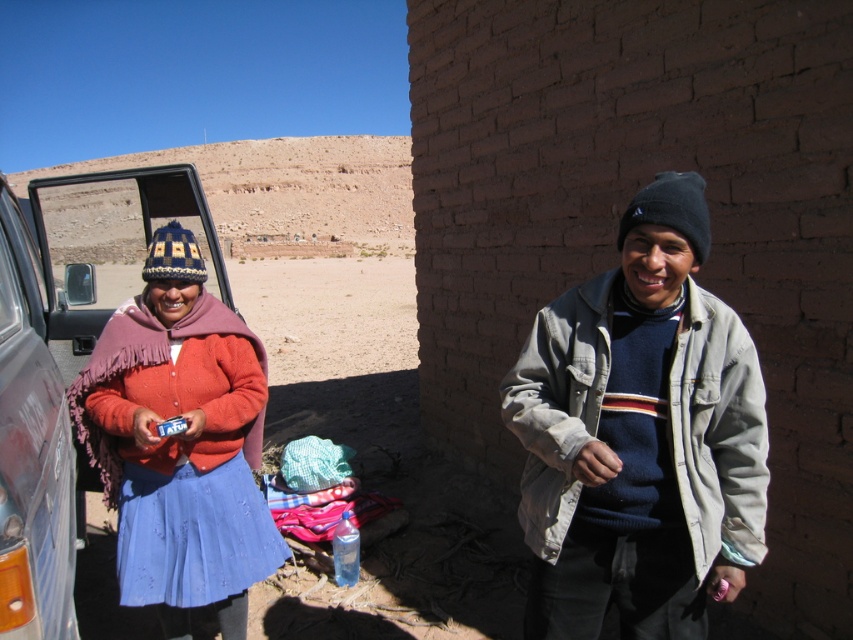
Question: Which point is closer to the camera taking this photo?

Choices:
 (A) (653, 218)
 (B) (16, 620)

Answer: (B)

Question: Does knitted woolen hat at left have a smaller size compared to metallic gray suv at left?

Choices:
 (A) no
 (B) yes

Answer: (B)

Question: Does light gray cotton jacket at right appear under knitted woolen hat at left?

Choices:
 (A) yes
 (B) no

Answer: (B)

Question: From the image, what is the correct spatial relationship of light gray cotton jacket at right in relation to knitted woolen hat at left?

Choices:
 (A) right
 (B) left

Answer: (A)

Question: Which object appears farthest from the camera in this image?

Choices:
 (A) metallic gray suv at left
 (B) knitted woolen hat at left
 (C) light gray cotton jacket at right

Answer: (B)

Question: Which of the following is the farthest from the observer?

Choices:
 (A) (225, 506)
 (B) (531, 422)
 (C) (33, 380)

Answer: (A)